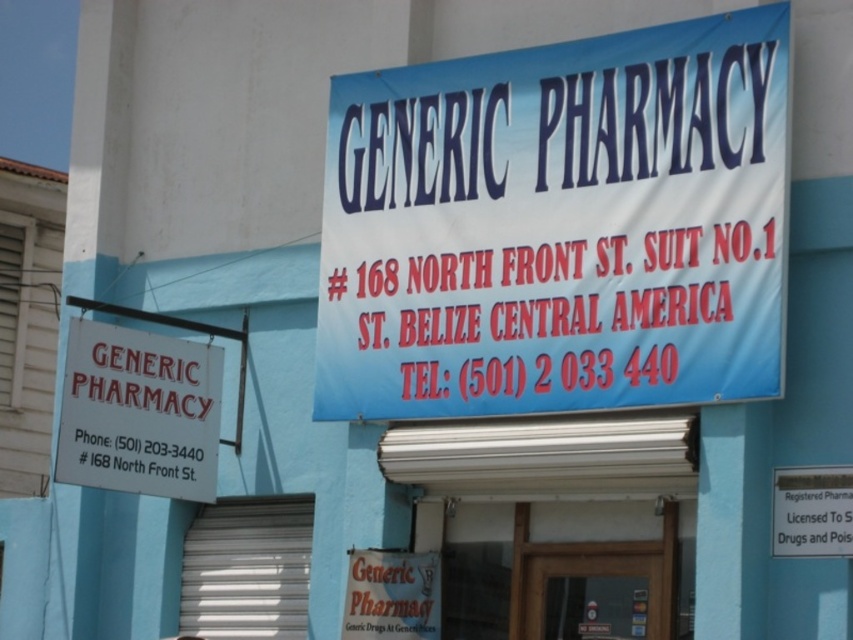
Does blue fabric sign at upper center appear on the left side of white paper sign at upper left?

In fact, blue fabric sign at upper center is to the right of white paper sign at upper left.

Which is in front, point (323, 364) or point (210, 344)?

Point (323, 364) is more forward.

Find the location of a particular element. blue fabric sign at upper center is located at coordinates (558, 227).